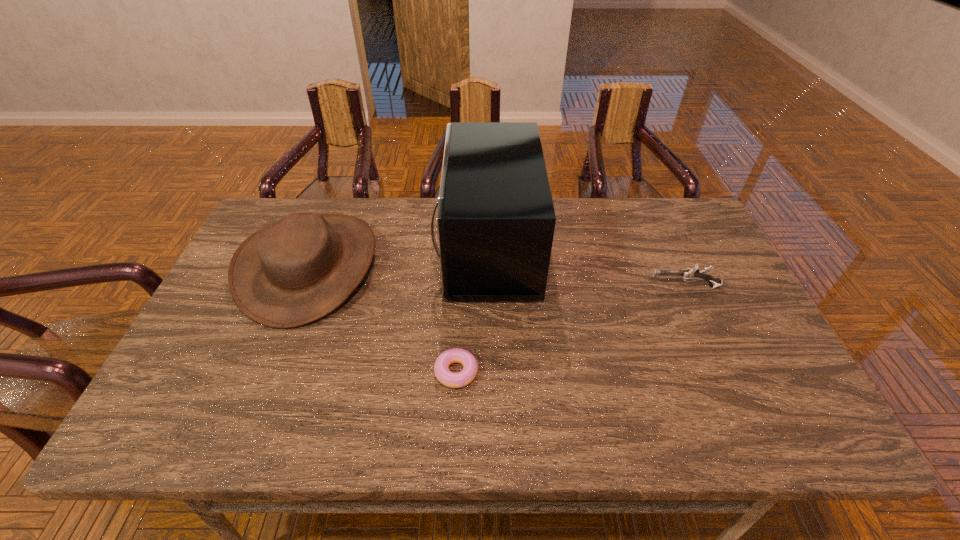
This screenshot has height=540, width=960. I want to click on microwave oven, so click(495, 220).

Locate an element on the screen. the third shortest object is located at coordinates (300, 268).

Image resolution: width=960 pixels, height=540 pixels. I want to click on the leftmost object, so click(300, 268).

The height and width of the screenshot is (540, 960). In order to click on gun in this screenshot , I will do `click(692, 274)`.

What are the coordinates of `the second shortest object` in the screenshot? It's located at (692, 274).

This screenshot has height=540, width=960. I want to click on the nearest object, so click(455, 355).

Identify the location of the shortest object. The width and height of the screenshot is (960, 540). (455, 355).

Locate an element on the screen. vacant space positioned 0.160m with the door open on the tallest object is located at coordinates (387, 247).

Where is `vacant space situated 0.240m with the door open on the tallest object`? vacant space situated 0.240m with the door open on the tallest object is located at coordinates (360, 247).

At what (x,y) coordinates should I click in order to perform the action: click on vacant space situated with the door open on the tallest object. Please return your answer as a coordinate pair (x, y). This screenshot has width=960, height=540. Looking at the image, I should click on (308, 247).